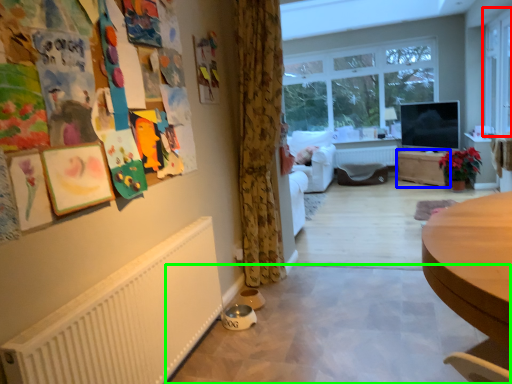
Question: Which object is the closest to the window (highlighted by a red box)? Choose among these: table (highlighted by a blue box) or plain (highlighted by a green box).

Choices:
 (A) table
 (B) plain

Answer: (A)